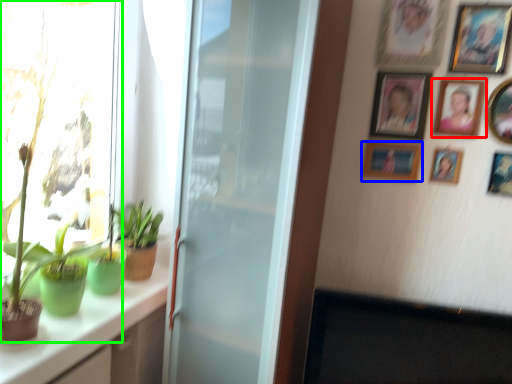
Question: Which object is the farthest from picture frame (highlighted by a red box)? Choose among these: picture frame (highlighted by a blue box) or houseplant (highlighted by a green box).

Choices:
 (A) picture frame
 (B) houseplant

Answer: (B)